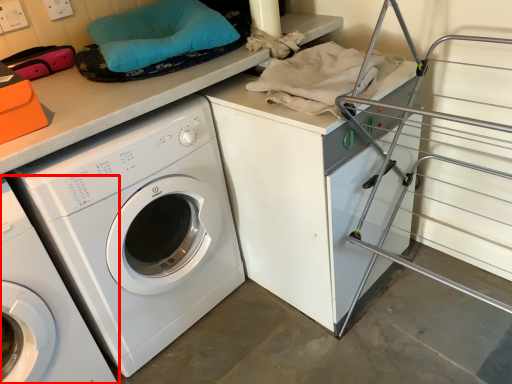
Question: Observing the image, what is the correct spatial positioning of washing machine (annotated by the red box) in reference to washing machine?

Choices:
 (A) right
 (B) left

Answer: (B)